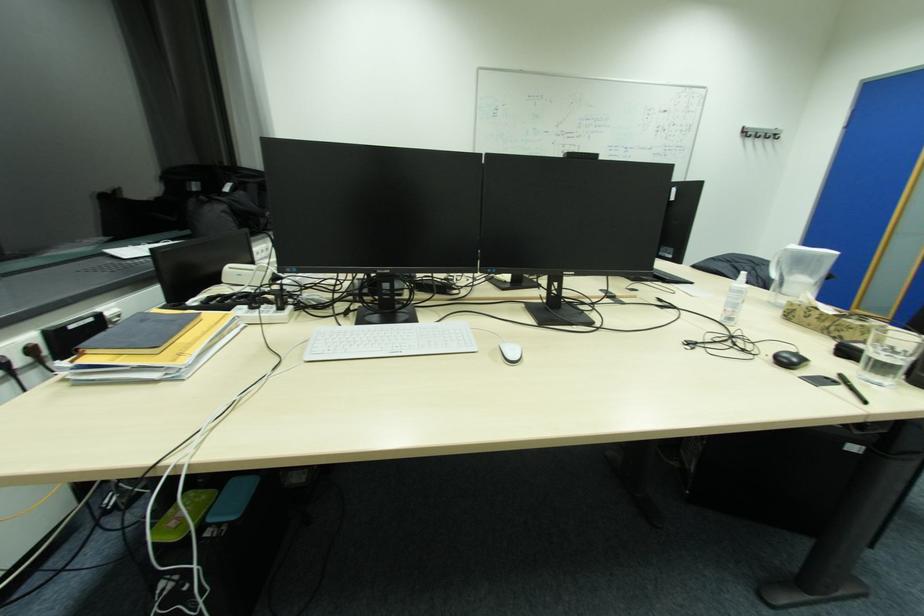
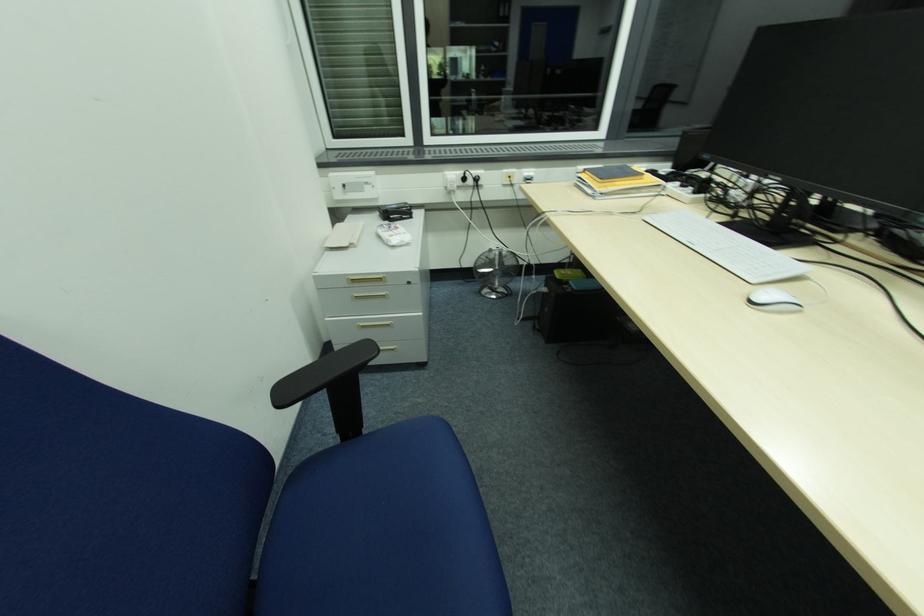
The images are taken continuously from a first-person perspective. In which direction is your viewpoint rotating?

The camera rotated toward left-down.